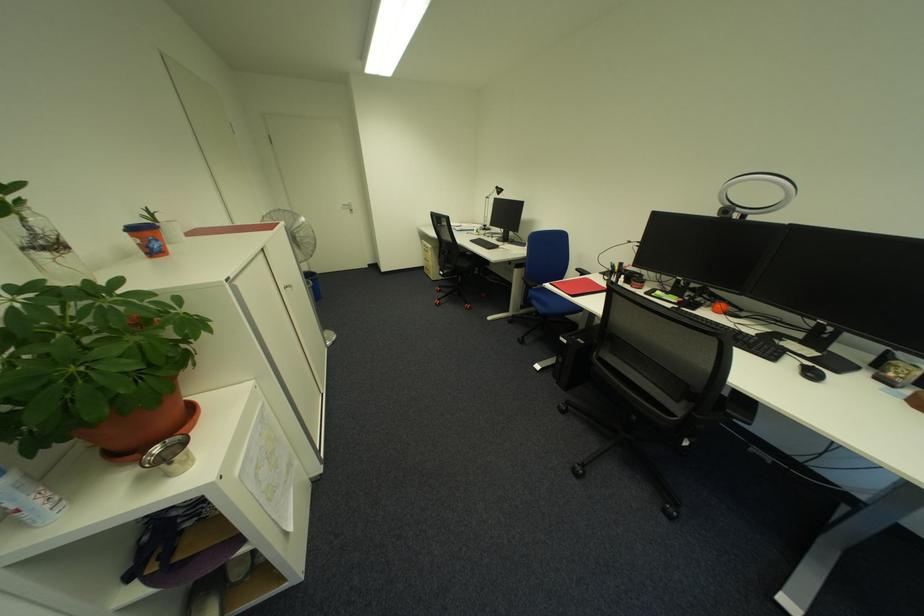
What do you see at coordinates (546, 297) in the screenshot? The height and width of the screenshot is (616, 924). I see `a blue chair armrest` at bounding box center [546, 297].